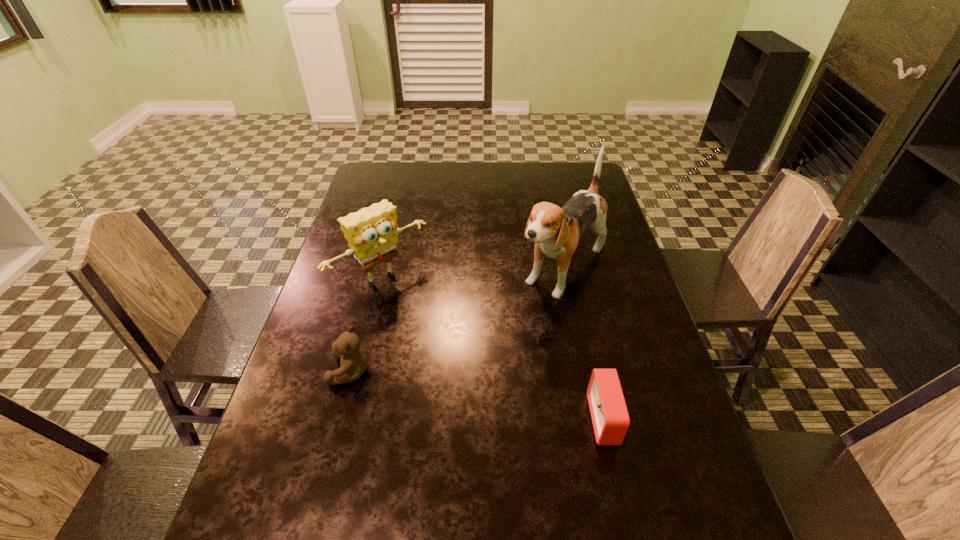
At what (x,y) coordinates should I click in order to perform the action: click on free point between the tallest object and the nearest object. Please return your answer as a coordinate pair (x, y). Image resolution: width=960 pixels, height=540 pixels. Looking at the image, I should click on (584, 345).

Find the location of a particular element. This screenshot has height=540, width=960. free spot between the tallest object and the teddy bear is located at coordinates (457, 320).

Locate an element on the screen. The image size is (960, 540). vacant space that's between the third farthest object and the nearest object is located at coordinates click(x=478, y=395).

Locate an element on the screen. The image size is (960, 540). free spot between the third shortest object and the third tallest object is located at coordinates (367, 325).

Find the location of a particular element. This screenshot has width=960, height=540. vacant area that lies between the sponge and the puppy is located at coordinates (473, 274).

Locate an element on the screen. unoccupied area between the alarm clock and the third tallest object is located at coordinates (478, 395).

Find the location of a particular element. The image size is (960, 540). object that stands as the second closest to the second tallest object is located at coordinates (556, 231).

Locate which object is the third closest to the tallest object. Please provide its 2D coordinates. Your answer should be formatted as a tuple, i.e. [(x, y)], where the tuple contains the x and y coordinates of a point satisfying the conditions above.

[(353, 362)]

Identify the location of vacant space that satisfies the following two spatial constraints: 1. on the front side of the sponge; 2. on the front-facing side of the nearest object. (349, 420).

Where is `blank area in the image that satisfies the following two spatial constraints: 1. on the front side of the shortest object; 2. on the front-facing side of the sponge`? This screenshot has width=960, height=540. blank area in the image that satisfies the following two spatial constraints: 1. on the front side of the shortest object; 2. on the front-facing side of the sponge is located at coordinates (349, 420).